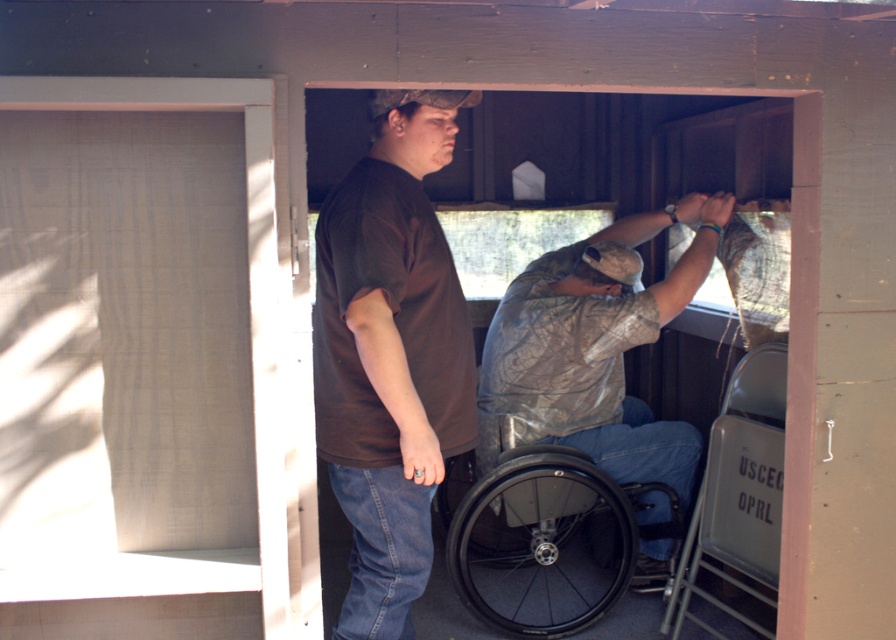
You are a delivery person who needs to enter the cabin through the open door. There is a black rubber wheelchair at lower center and a camouflage fabric shirt at center in the way. Can you walk through the space between them?

The black rubber wheelchair at lower center is larger in size than camouflage fabric shirt at center, so the space between them may be sufficient for you to walk through. However, since the wheelchair is larger, you should check the actual distance before proceeding to ensure safety.

You are a photographer setting up a shoot in a cabin. You have two subjects wearing a brown matte shirt at center and a camouflage fabric shirt at center. Based on their positions, which subject should you position closer to the camera to ensure both appear equally tall in the photo?

The camouflage fabric shirt at center should be positioned closer to the camera because the brown matte shirt at center is taller in reality. By moving the shorter subject closer, their apparent height in the photo will match the taller subject standing farther back.